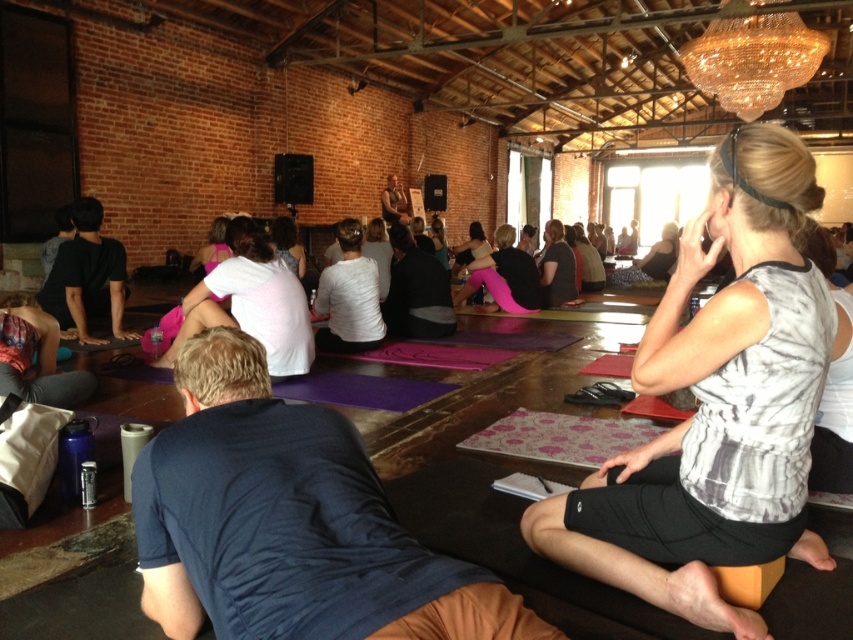
Question: Does white printed tank top at center appear on the left side of white matte shirt at center?

Choices:
 (A) yes
 (B) no

Answer: (B)

Question: Which object is farther from the camera taking this photo?

Choices:
 (A) white matte shirt at center
 (B) white printed tank top at center

Answer: (A)

Question: Which point is farther from the camera taking this photo?

Choices:
 (A) (357, 232)
 (B) (693, 600)

Answer: (A)

Question: Observing the image, what is the correct spatial positioning of white printed tank top at center in reference to pink yoga pants at center?

Choices:
 (A) left
 (B) right

Answer: (B)

Question: Among these points, which one is nearest to the camera?

Choices:
 (A) (341, 244)
 (B) (506, 275)
 (C) (247, 291)
 (D) (639, 513)

Answer: (D)

Question: Observing the image, what is the correct spatial positioning of white printed tank top at center in reference to white cotton shirt at center?

Choices:
 (A) left
 (B) right

Answer: (B)